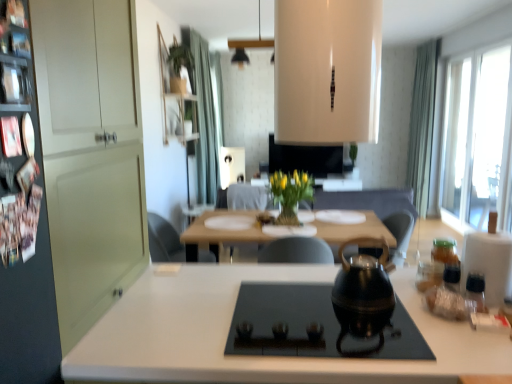
What is the approximate width of metallic silver shelf at upper left?

metallic silver shelf at upper left is 2.88 centimeters wide.

What do you see at coordinates (362, 287) in the screenshot?
I see `black matte tea pot at center` at bounding box center [362, 287].

This screenshot has height=384, width=512. Find the location of `green fabric curtain at upper right, the 1th curtain viewed from the right`. green fabric curtain at upper right, the 1th curtain viewed from the right is located at coordinates (422, 124).

Describe the element at coordinates (447, 259) in the screenshot. I see `transparent plastic jar at right, the 3th bottle positioned from the front` at that location.

Locate an element on the screen. The width and height of the screenshot is (512, 384). transparent glass window at right is located at coordinates (476, 135).

Describe the element at coordinates (476, 135) in the screenshot. I see `transparent glass window at right` at that location.

You are a GUI agent. You are given a task and a screenshot of the screen. Output one action in this format:
    pyautogui.click(x=<x>, y=<y>)
    Task: Click on the metallic silver shelf at upper left
    Image resolution: width=512 pixels, height=384 pixels.
    Given the screenshot: What is the action you would take?
    pyautogui.click(x=15, y=81)

From a real-world perspective, is black glass cooktop at center over translucent glass jar at right, which appears as the second bottle when viewed from the back?

No, from a real-world perspective, black glass cooktop at center is not on top of translucent glass jar at right, which appears as the second bottle when viewed from the back.

Is black glass cooktop at center spatially inside translucent glass jar at right, which appears as the second bottle when viewed from the back, or outside of it?

The correct answer is: outside.

At what (x,y) coordinates should I click in order to perform the action: click on the 2nd bottle positioned above the black glass cooktop at center (from a real-world perspective). Please return your answer as a coordinate pair (x, y). This screenshot has height=384, width=512. Looking at the image, I should click on (448, 296).

From the image's perspective, does black glass cooktop at center appear lower than translucent glass jar at right, which appears as the second bottle when viewed from the back?

Yes, from the image's perspective, black glass cooktop at center is below translucent glass jar at right, which appears as the second bottle when viewed from the back.

Can you tell me how much transparent plastic bottle at right, which ranks as the 3th bottle in back-to-front order, and white glossy countertop at center differ in facing direction?

There is a 0.417-degree angle between the facing directions of transparent plastic bottle at right, which ranks as the 3th bottle in back-to-front order, and white glossy countertop at center.

Is transparent plastic bottle at right, which ranks as the 3th bottle in back-to-front order, in front of or behind white glossy countertop at center in the image?

In the image, transparent plastic bottle at right, which ranks as the 3th bottle in back-to-front order, appears behind white glossy countertop at center.

Is transparent plastic bottle at right, which ranks as the 3th bottle in back-to-front order, positioned with its back to white glossy countertop at center?

No.

The image size is (512, 384). In order to click on glass vase lying above the wooden table at center (from the image's perspective) in this screenshot , I will do `click(288, 216)`.

Considering the relative sizes of clear glass vase at center and wooden table at center in the image provided, is clear glass vase at center taller than wooden table at center?

In fact, clear glass vase at center may be shorter than wooden table at center.

Considering the sizes of objects clear glass vase at center and wooden table at center in the image provided, who is bigger, clear glass vase at center or wooden table at center?

Bigger between the two is wooden table at center.

Does clear glass vase at center have a greater width compared to wooden table at center?

In fact, clear glass vase at center might be narrower than wooden table at center.

Considering the positions of objects white glossy countertop at center and metallic silver shelf at upper left in the image provided, who is behind, white glossy countertop at center or metallic silver shelf at upper left?

Positioned behind is white glossy countertop at center.

Can you tell me how much white glossy countertop at center and metallic silver shelf at upper left differ in facing direction?

The facing directions of white glossy countertop at center and metallic silver shelf at upper left are 91.7 degrees apart.

How much distance is there between white glossy countertop at center and metallic silver shelf at upper left?

96.44 centimeters.

From the image's perspective, between white glossy countertop at center and metallic silver shelf at upper left, which one is located above?

metallic silver shelf at upper left, from the image's perspective.

Consider the image. Considering the relative positions of green fabric curtain at upper center, acting as the second curtain starting from the right, and black glass cooktop at center in the image provided, is green fabric curtain at upper center, acting as the second curtain starting from the right, behind black glass cooktop at center?

Yes.

Can you confirm if green fabric curtain at upper center, acting as the second curtain starting from the right, is thinner than black glass cooktop at center?

Yes.

From the picture: How different are the orientations of green fabric curtain at upper center, which is counted as the first curtain, starting from the left, and black glass cooktop at center in degrees?

There is a 88.9-degree angle between the facing directions of green fabric curtain at upper center, which is counted as the first curtain, starting from the left, and black glass cooktop at center.

Between black matte tea pot at center and transparent plastic jar at right, the 3th bottle positioned from the front, which one has smaller size?

With smaller size is transparent plastic jar at right, the 3th bottle positioned from the front.

Find the location of a particular element. The image size is (512, 384). tea pot lying above the transparent plastic jar at right, acting as the first bottle starting from the back (from the image's perspective) is located at coordinates (362, 287).

Looking at this image, does black matte tea pot at center have a greater width compared to transparent plastic jar at right, acting as the first bottle starting from the back?

Yes, black matte tea pot at center is wider than transparent plastic jar at right, acting as the first bottle starting from the back.

Which object is positioned more to the right, black matte tea pot at center or transparent plastic jar at right, the 3th bottle positioned from the front?

transparent plastic jar at right, the 3th bottle positioned from the front.

Is green fabric curtain at upper right, which appears as the 2th curtain when viewed from the left, not near clear glass vase at center?

That's right, there is a large distance between green fabric curtain at upper right, which appears as the 2th curtain when viewed from the left, and clear glass vase at center.

At what (x,y) coordinates should I click in order to perform the action: click on glass vase on the left of green fabric curtain at upper right, which appears as the 2th curtain when viewed from the left. Please return your answer as a coordinate pair (x, y). Image resolution: width=512 pixels, height=384 pixels. Looking at the image, I should click on (288, 216).

From the image's perspective, which one is positioned higher, green fabric curtain at upper right, the 1th curtain viewed from the right, or clear glass vase at center?

green fabric curtain at upper right, the 1th curtain viewed from the right, from the image's perspective.

Which of these two, green fabric curtain at upper right, the 1th curtain viewed from the right, or clear glass vase at center, is bigger?

Bigger between the two is green fabric curtain at upper right, the 1th curtain viewed from the right.

Locate an element on the screen. The height and width of the screenshot is (384, 512). kitchen appliance below the translucent glass jar at right, which appears as the second bottle when viewed from the back (from the image's perspective) is located at coordinates (318, 326).

You are a GUI agent. You are given a task and a screenshot of the screen. Output one action in this format:
    pyautogui.click(x=<x>, y=<y>)
    Task: Click on the countertop below the transparent plastic bottle at right, which ranks as the first bottle in front-to-back order (from a real-world perspective)
    Image resolution: width=512 pixels, height=384 pixels.
    Given the screenshot: What is the action you would take?
    pyautogui.click(x=257, y=356)

When comparing their distances from yellow matte vase at center, does white glossy countertop at center or black glass cooktop at center seem closer?

Based on the image, white glossy countertop at center appears to be nearer to yellow matte vase at center.

Based on their spatial positions, is translucent glass jar at right, which appears as the second bottle when viewed from the back, or clear glass vase at center closer to metallic silver shelf at upper left?

Among the two, translucent glass jar at right, which appears as the second bottle when viewed from the back, is located nearer to metallic silver shelf at upper left.

Estimate the real-world distances between objects in this image. Which object is closer to translucent glass jar at right, arranged as the 2th bottle when viewed from the front, black glass cooktop at center or transparent glass window at right?

The object closer to translucent glass jar at right, arranged as the 2th bottle when viewed from the front, is black glass cooktop at center.

Looking at the image, which one is located closer to transparent plastic jar at right, the 3th bottle positioned from the front, metallic silver shelf at upper left or black glass cooktop at center?

black glass cooktop at center is positioned closer to the anchor transparent plastic jar at right, the 3th bottle positioned from the front.

Looking at the image, which one is located further to white glossy countertop at center, metallic silver shelf at upper left or green fabric curtain at upper center, which is counted as the first curtain, starting from the left?

Based on the image, green fabric curtain at upper center, which is counted as the first curtain, starting from the left, appears to be further to white glossy countertop at center.

Looking at this image, from the image, which object appears to be farther from transparent glass window at right, black glass cooktop at center or clear glass vase at center?

black glass cooktop at center.

Looking at this image, looking at the image, which one is located further to black matte tea pot at center, transparent glass window at right or clear glass vase at center?

Based on the image, transparent glass window at right appears to be further to black matte tea pot at center.

Estimate the real-world distances between objects in this image. Which object is further from transparent glass window at right, clear glass vase at center or wooden table at center?

Based on the image, wooden table at center appears to be further to transparent glass window at right.

Where is `flower between black matte tea pot at center and green fabric curtain at upper right, which appears as the 2th curtain when viewed from the left, along the z-axis`? This screenshot has height=384, width=512. flower between black matte tea pot at center and green fabric curtain at upper right, which appears as the 2th curtain when viewed from the left, along the z-axis is located at coordinates [x=291, y=188].

At what (x,y) coordinates should I click in order to perform the action: click on glass vase between black matte tea pot at center and transparent glass window at right in the front-back direction. Please return your answer as a coordinate pair (x, y). The height and width of the screenshot is (384, 512). Looking at the image, I should click on (288, 216).

This screenshot has width=512, height=384. I want to click on bottle between metallic silver shelf at upper left and transparent plastic bottle at right, which ranks as the 3th bottle in back-to-front order, from left to right, so click(448, 296).

Where is `kitchen appliance situated between white glossy countertop at center and transparent plastic jar at right, the 3th bottle positioned from the front, from left to right`? The image size is (512, 384). kitchen appliance situated between white glossy countertop at center and transparent plastic jar at right, the 3th bottle positioned from the front, from left to right is located at coordinates (318, 326).